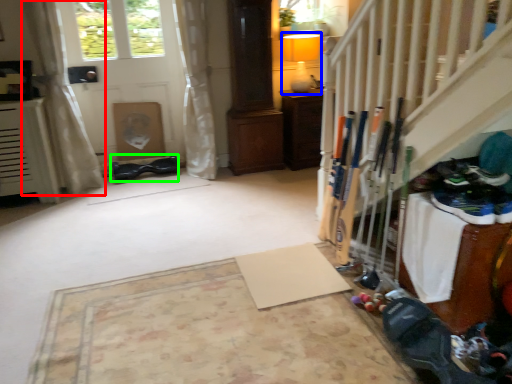
Question: Estimate the real-world distances between objects in this image. Which object is farther from curtain (highlighted by a red box), lamp (highlighted by a blue box) or shoe (highlighted by a green box)?

Choices:
 (A) lamp
 (B) shoe

Answer: (A)